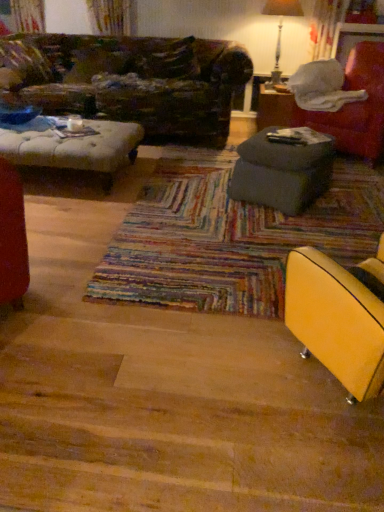
Question: From the image's perspective, is metallic silver table lamp at upper right over matte gray ottoman at center, the 2th table from the bottom?

Choices:
 (A) yes
 (B) no

Answer: (A)

Question: Does metallic silver table lamp at upper right have a greater height compared to matte gray ottoman at center, the 1th table when ordered from top to bottom?

Choices:
 (A) no
 (B) yes

Answer: (B)

Question: Considering the relative sizes of metallic silver table lamp at upper right and matte gray ottoman at center, which ranks as the first table in back-to-front order, in the image provided, is metallic silver table lamp at upper right smaller than matte gray ottoman at center, which ranks as the first table in back-to-front order,?

Choices:
 (A) no
 (B) yes

Answer: (A)

Question: Is metallic silver table lamp at upper right positioned with its back to matte gray ottoman at center, the 2th table from the bottom?

Choices:
 (A) yes
 (B) no

Answer: (B)

Question: Does metallic silver table lamp at upper right have a greater width compared to matte gray ottoman at center, the 1th table when ordered from top to bottom?

Choices:
 (A) no
 (B) yes

Answer: (A)

Question: Is metallic silver table lamp at upper right at the left side of matte gray ottoman at center, the 2th table from the bottom?

Choices:
 (A) yes
 (B) no

Answer: (A)

Question: Does velvet red armchair at right, which is counted as the 2th chair, starting from the front, have a smaller size compared to yellow leather chair at lower right, the 1th chair positioned from the front?

Choices:
 (A) yes
 (B) no

Answer: (B)

Question: Is velvet red armchair at right, arranged as the first chair when viewed from the top, not within yellow leather chair at lower right, the 1th chair positioned from the front?

Choices:
 (A) yes
 (B) no

Answer: (A)

Question: Is velvet red armchair at right, which ranks as the second chair in left-to-right order, bigger than yellow leather chair at lower right, the 2th chair positioned from the right?

Choices:
 (A) no
 (B) yes

Answer: (B)

Question: Is velvet red armchair at right, arranged as the first chair when viewed from the top, touching yellow leather chair at lower right, arranged as the 1th chair when ordered from the bottom?

Choices:
 (A) yes
 (B) no

Answer: (B)

Question: Is velvet red armchair at right, which ranks as the second chair in left-to-right order, further to the viewer compared to yellow leather chair at lower right, which ranks as the 1th chair in left-to-right order?

Choices:
 (A) yes
 (B) no

Answer: (A)

Question: Does velvet red armchair at right, placed as the 1th chair when sorted from right to left, have a greater width compared to yellow leather chair at lower right, which ranks as the 1th chair in left-to-right order?

Choices:
 (A) no
 (B) yes

Answer: (B)

Question: Is metallic silver table lamp at upper right facing away from gray fabric ottoman at right, which is the second table in back-to-front order?

Choices:
 (A) yes
 (B) no

Answer: (B)